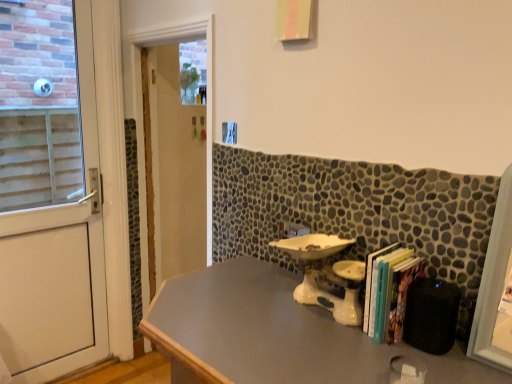
Identify the location of hardcover books at right. (390, 293).

The width and height of the screenshot is (512, 384). What do you see at coordinates (390, 293) in the screenshot?
I see `hardcover books at right` at bounding box center [390, 293].

Identify the location of hardcover books at right. Image resolution: width=512 pixels, height=384 pixels. (390, 293).

In terms of height, does smooth gray table at center look taller or shorter compared to white ceramic sink at center?

smooth gray table at center is taller than white ceramic sink at center.

Which object is more forward, smooth gray table at center or white ceramic sink at center?

smooth gray table at center is more forward.

Which is more to the right, smooth gray table at center or white ceramic sink at center?

From the viewer's perspective, white ceramic sink at center appears more on the right side.

I want to click on door to the left of white glossy door at center, so click(x=49, y=193).

Who is shorter, white glossy door at center or white matte door at left?

Standing shorter between the two is white glossy door at center.

Considering the relative sizes of white matte door at left and smooth gray table at center in the image provided, is white matte door at left shorter than smooth gray table at center?

No.

In the scene shown: Is white matte door at left facing away from smooth gray table at center?

white matte door at left is not turned away from smooth gray table at center.

How far apart are white matte door at left and smooth gray table at center?

3.51 meters.

Based on their sizes in the image, would you say white matte door at left is bigger or smaller than smooth gray table at center?

In the image, white matte door at left appears to be smaller than smooth gray table at center.

In terms of width, does white glossy door at center look wider or thinner when compared to hardcover books at right?

Clearly, white glossy door at center has less width compared to hardcover books at right.

Find the location of a particular element. This screenshot has width=512, height=384. book lying on the right of white glossy door at center is located at coordinates (390, 293).

Is white glossy door at center not near hardcover books at right?

Yes.

Is white glossy door at center inside or outside of hardcover books at right?

white glossy door at center is not enclosed by hardcover books at right.

From the image's perspective, relative to white matte door at left, is smooth gray table at center above or below?

Clearly, from the image's perspective, smooth gray table at center is below white matte door at left.

Is smooth gray table at center aimed at white matte door at left?

No, smooth gray table at center is not facing towards white matte door at left.

Which is behind, point (176, 322) or point (3, 334)?

The point (3, 334) is farther.

Which of these two, smooth gray table at center or white matte door at left, is wider?

smooth gray table at center is wider.

Could you tell me if hardcover books at right is turned towards white ceramic sink at center?

No, hardcover books at right is not aimed at white ceramic sink at center.

Can you confirm if hardcover books at right is wider than white ceramic sink at center?

In fact, hardcover books at right might be narrower than white ceramic sink at center.

From a real-world perspective, which object stands above the other?

From a 3D spatial view, hardcover books at right is above.

From the image's perspective, is hardcover books at right beneath white ceramic sink at center?

Indeed, from the image's perspective, hardcover books at right is shown beneath white ceramic sink at center.

Can you confirm if smooth gray table at center is taller than hardcover books at right?

Indeed, smooth gray table at center has a greater height compared to hardcover books at right.

Between smooth gray table at center and hardcover books at right, which one has larger size?

Bigger between the two is smooth gray table at center.

Is smooth gray table at center placed right next to hardcover books at right?

No, smooth gray table at center is not next to hardcover books at right.

Does smooth gray table at center come in front of hardcover books at right?

Yes, it is.

Locate an element on the screen. The height and width of the screenshot is (384, 512). sink above the smooth gray table at center (from a real-world perspective) is located at coordinates (322, 274).

Where is `screen door on the right of white matte door at left`? Image resolution: width=512 pixels, height=384 pixels. screen door on the right of white matte door at left is located at coordinates (207, 88).

Based on the photo, based on their spatial positions, is white ceramic sink at center or hardcover books at right further from white matte door at left?

hardcover books at right is further to white matte door at left.

Based on their spatial positions, is white ceramic sink at center or white glossy door at center closer to white matte door at left?

white glossy door at center lies closer to white matte door at left than the other object.

In the scene shown: Considering their positions, is white glossy door at center positioned further to hardcover books at right than smooth gray table at center?

white glossy door at center is positioned further to the anchor hardcover books at right.

Which object lies further to the anchor point smooth gray table at center, white matte door at left or white glossy door at center?

Among the two, white matte door at left is located further to smooth gray table at center.

When comparing their distances from smooth gray table at center, does hardcover books at right or white glossy door at center seem closer?

Based on the image, hardcover books at right appears to be nearer to smooth gray table at center.

Based on their spatial positions, is hardcover books at right or white matte door at left closer to white ceramic sink at center?

hardcover books at right.

From the image, which object appears to be nearer to white ceramic sink at center, smooth gray table at center or white matte door at left?

The object closer to white ceramic sink at center is smooth gray table at center.

When comparing their distances from smooth gray table at center, does white glossy door at center or white ceramic sink at center seem further?

white glossy door at center.

You are a GUI agent. You are given a task and a screenshot of the screen. Output one action in this format:
    pyautogui.click(x=<x>, y=<y>)
    Task: Click on the sink located between white glossy door at center and hardcover books at right in the left-right direction
    Image resolution: width=512 pixels, height=384 pixels.
    Given the screenshot: What is the action you would take?
    pyautogui.click(x=322, y=274)

Locate an element on the screen. sink located between smooth gray table at center and white glossy door at center in the depth direction is located at coordinates (322, 274).

Identify the location of screen door between white matte door at left and white ceramic sink at center in the horizontal direction. (207, 88).

The image size is (512, 384). In order to click on table between white matte door at left and hardcover books at right in this screenshot , I will do `click(275, 334)`.